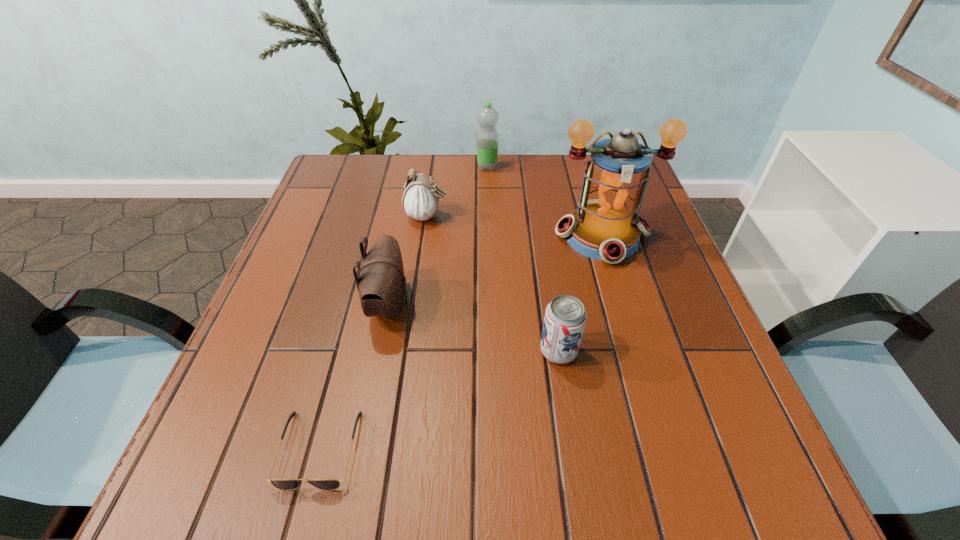
What are the coordinates of `vacant space that satisfies the following two spatial constraints: 1. on the front-facing side of the beer can; 2. on the right side of the farther pouch` in the screenshot? It's located at (409, 352).

Image resolution: width=960 pixels, height=540 pixels. Find the location of `vacant space that satisfies the following two spatial constraints: 1. with the flap open on the nearer pouch; 2. on the right side of the beer can`. vacant space that satisfies the following two spatial constraints: 1. with the flap open on the nearer pouch; 2. on the right side of the beer can is located at coordinates (379, 352).

You are a GUI agent. You are given a task and a screenshot of the screen. Output one action in this format:
    pyautogui.click(x=<x>, y=<y>)
    Task: Click on the vacant area in the image that satisfies the following two spatial constraints: 1. on the front-facing side of the tallest object; 2. with the flap open on the nearer pouch
    Image resolution: width=960 pixels, height=540 pixels.
    Given the screenshot: What is the action you would take?
    pyautogui.click(x=622, y=304)